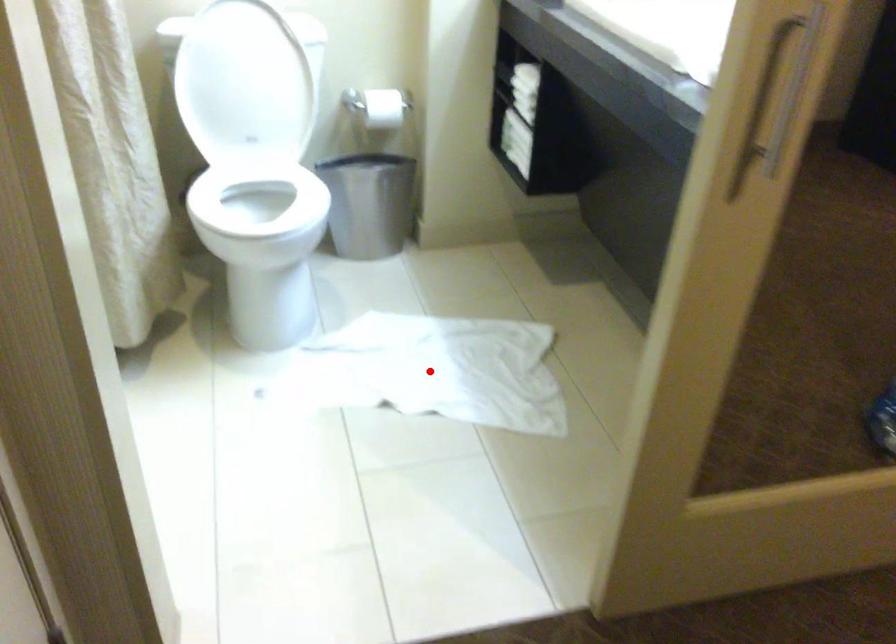
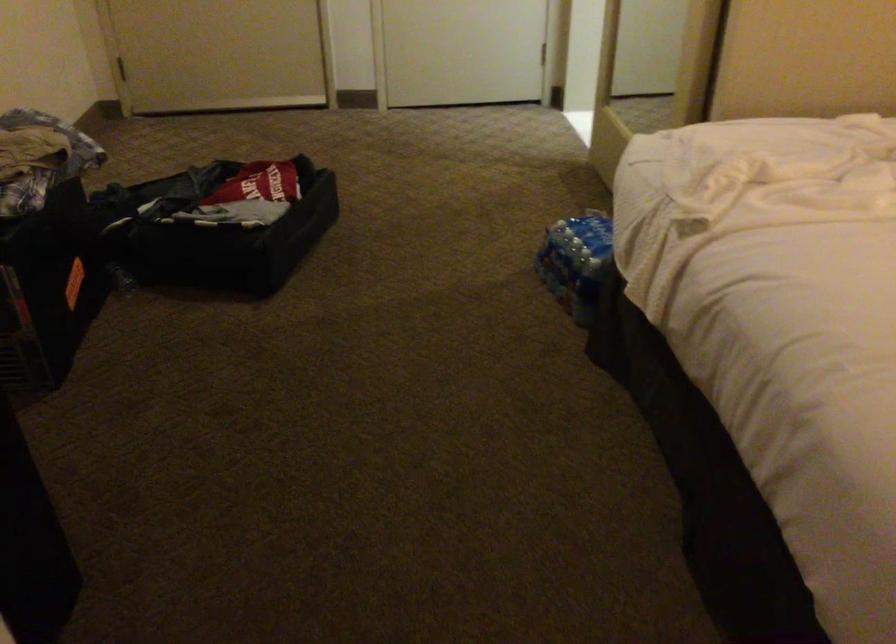
Question: I am providing you with two images of the same scene from different viewpoints. A red point is marked on the first image. Can you still see the location of the red point in image 2?

Choices:
 (A) Yes
 (B) No

Answer: (B)